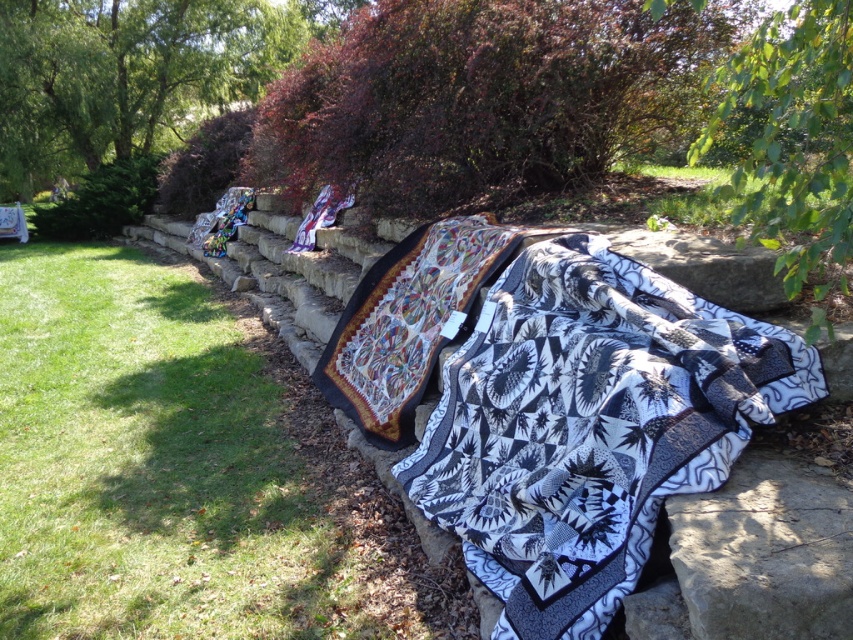
Can you confirm if green leafy tree at upper center is bigger than green leafy tree at upper right?

No.

Is green leafy tree at upper center positioned at the back of green leafy tree at upper right?

That is True.

This screenshot has width=853, height=640. Identify the location of green leafy tree at upper center. (125, 76).

Which of these two, purple leafy bush at upper center or green leafy tree at upper right, stands shorter?

Standing shorter between the two is purple leafy bush at upper center.

Does purple leafy bush at upper center appear over green leafy tree at upper right?

Yes.

Between point (409, 97) and point (779, 88), which one is positioned in front?

Point (779, 88) is in front.

Find the location of `purple leafy bush at upper center`. purple leafy bush at upper center is located at coordinates (480, 99).

In the scene shown: Which is above, black quilt at center or green leafy tree at upper right?

green leafy tree at upper right is above.

Can you confirm if black quilt at center is bigger than green leafy tree at upper right?

Yes.

Between point (427, 470) and point (764, 195), which one is positioned in front?

Point (764, 195) is in front.

Find the location of a particular element. This screenshot has width=853, height=640. black quilt at center is located at coordinates (590, 426).